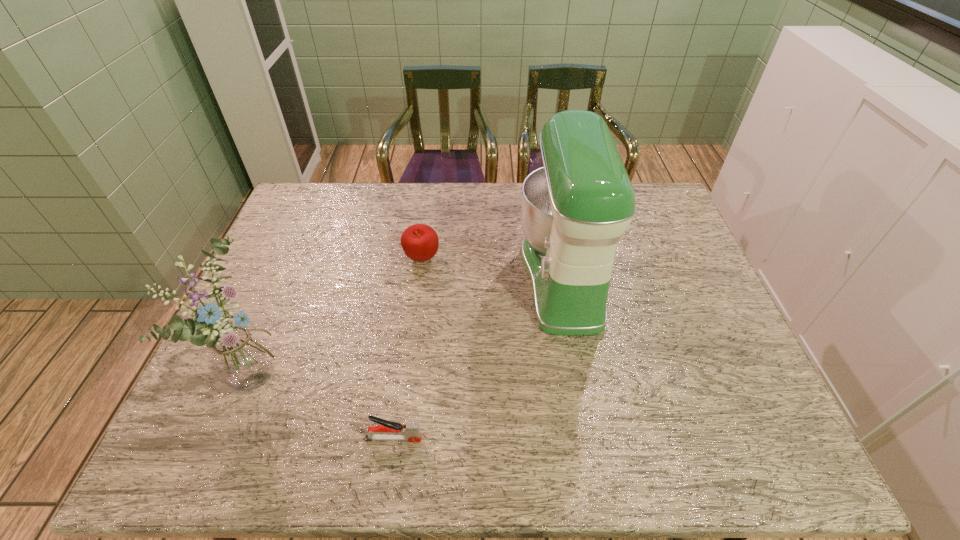
Identify the location of free point located on the handle side of the stapler. The width and height of the screenshot is (960, 540). (528, 438).

Find the location of `object positioned at the near edge`. object positioned at the near edge is located at coordinates (387, 430).

Where is `object at the left edge`? object at the left edge is located at coordinates (242, 359).

The width and height of the screenshot is (960, 540). I want to click on free space at the far edge, so [x=513, y=186].

Find the location of a particular element. This screenshot has height=540, width=960. vacant space at the near edge is located at coordinates (461, 461).

In the image, there is a desktop. Where is `vacant region at the left edge`? This screenshot has height=540, width=960. vacant region at the left edge is located at coordinates (226, 402).

The image size is (960, 540). Identify the location of vacant space at the right edge. (637, 226).

This screenshot has height=540, width=960. I want to click on free space at the far left corner of the desktop, so click(x=295, y=215).

Locate an element on the screen. This screenshot has width=960, height=540. vacant space that is in between the mixer and the bouquet is located at coordinates (412, 323).

You are a GUI agent. You are given a task and a screenshot of the screen. Output one action in this format:
    pyautogui.click(x=<x>, y=<y>)
    Task: Click on the free space that is in between the nearest object and the mixer
    This screenshot has width=960, height=540.
    Given the screenshot: What is the action you would take?
    click(478, 357)